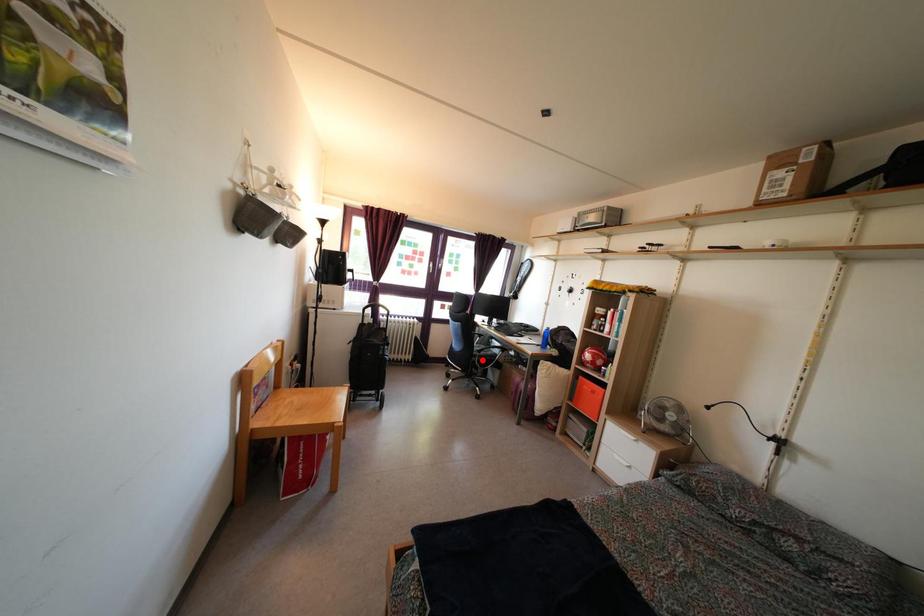
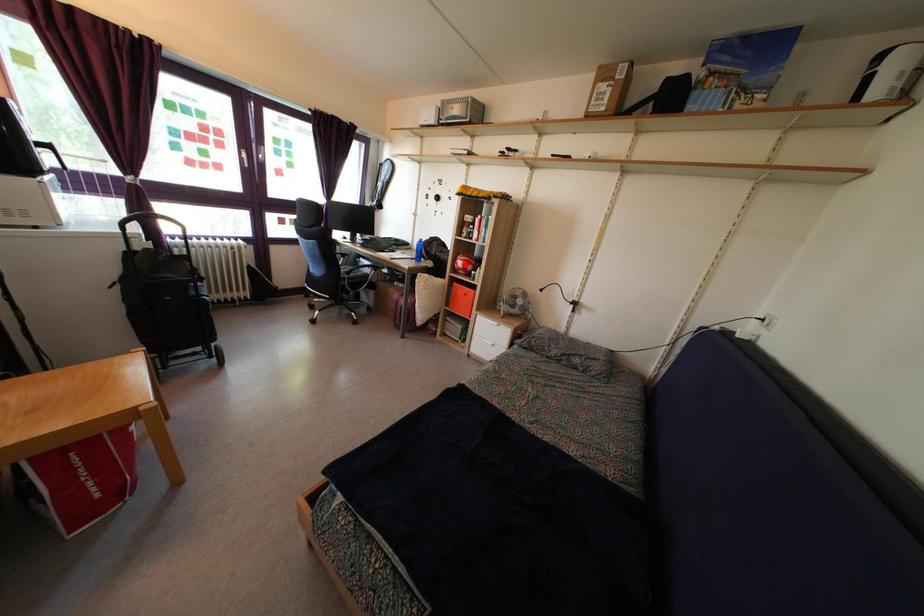
I am providing you with two images of the same scene from different viewpoints. A red point is marked on the first image and another point is marked on the second image. Is the marked point in image1 the same physical position as the marked point in image2?

No